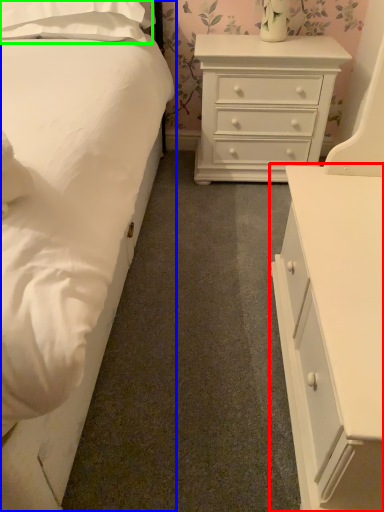
Question: Estimate the real-world distances between objects in this image. Which object is closer to chest of drawers (highlighted by a red box), bed (highlighted by a blue box) or pillow (highlighted by a green box)?

Choices:
 (A) bed
 (B) pillow

Answer: (A)